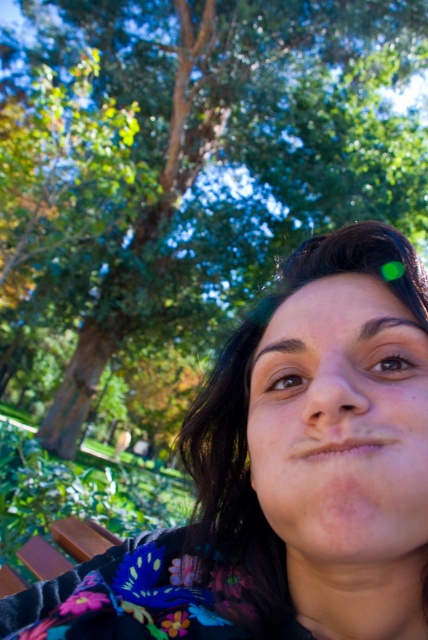
Question: Among these objects, which one is farthest from the camera?

Choices:
 (A) green leafy tree at upper center
 (B) floral fabric at center

Answer: (A)

Question: Which point is farther from the camera taking this photo?

Choices:
 (A) (380, 19)
 (B) (133, 634)

Answer: (A)

Question: Can you confirm if floral fabric at center is bigger than green leafy tree at upper center?

Choices:
 (A) yes
 (B) no

Answer: (B)

Question: Is floral fabric at center in front of green leafy tree at upper center?

Choices:
 (A) yes
 (B) no

Answer: (A)

Question: Which point is closer to the camera taking this photo?

Choices:
 (A) (115, 321)
 (B) (201, 449)

Answer: (B)

Question: Can you confirm if floral fabric at center is positioned to the left of green leafy tree at upper center?

Choices:
 (A) no
 (B) yes

Answer: (A)